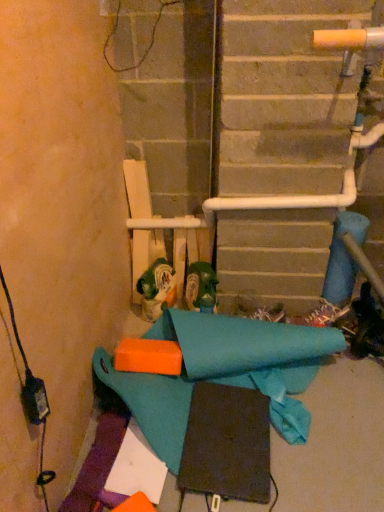
Question: Considering the positions of green matte boot at center and green plastic beer can at center in the image, is green matte boot at center wider or thinner than green plastic beer can at center?

Choices:
 (A) thin
 (B) wide

Answer: (A)

Question: Does point (201, 271) appear closer or farther from the camera than point (173, 280)?

Choices:
 (A) farther
 (B) closer

Answer: (B)

Question: Would you say green matte boot at center is to the left or to the right of green plastic beer can at center in the picture?

Choices:
 (A) right
 (B) left

Answer: (A)

Question: Considering their positions, is green plastic beer can at center located in front of or behind green matte boot at center?

Choices:
 (A) front
 (B) behind

Answer: (B)

Question: Is point (162, 276) closer or farther from the camera than point (187, 292)?

Choices:
 (A) farther
 (B) closer

Answer: (A)

Question: Choose the correct answer: Is green plastic beer can at center inside green matte boot at center or outside it?

Choices:
 (A) inside
 (B) outside

Answer: (B)

Question: In terms of height, does green plastic beer can at center look taller or shorter compared to green matte boot at center?

Choices:
 (A) short
 (B) tall

Answer: (B)